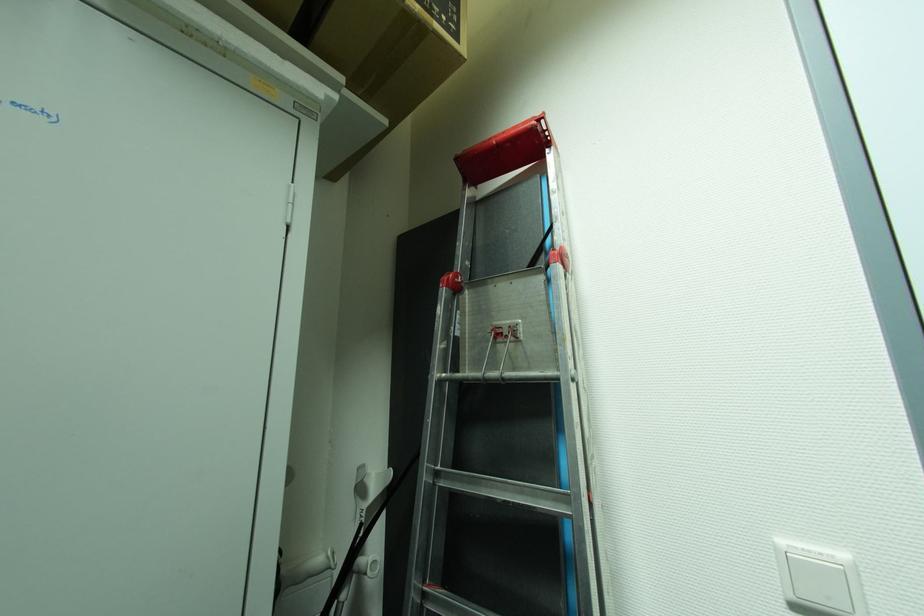
Where would you lift the cardboard box? Please return your answer as a coordinate pair (x, y).

(392, 55)